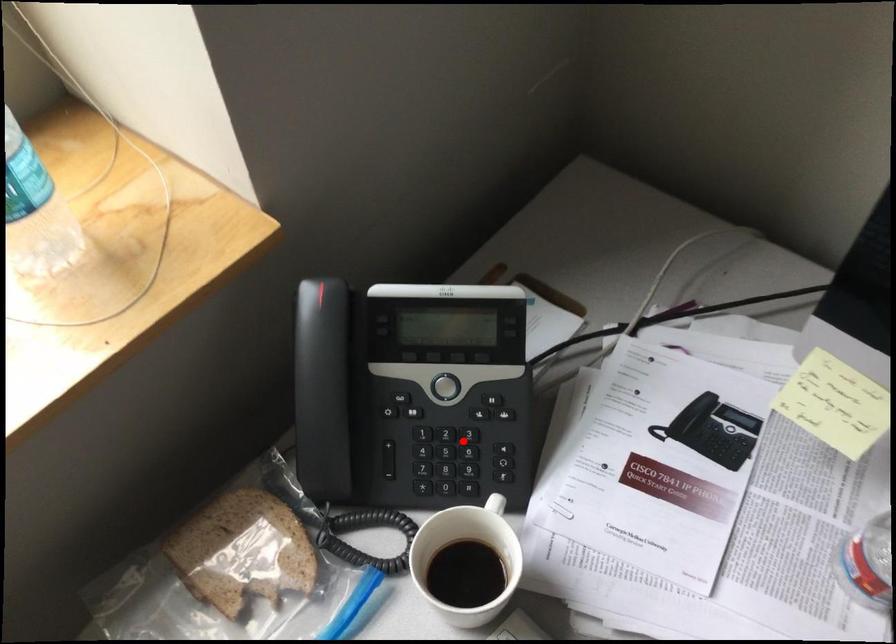
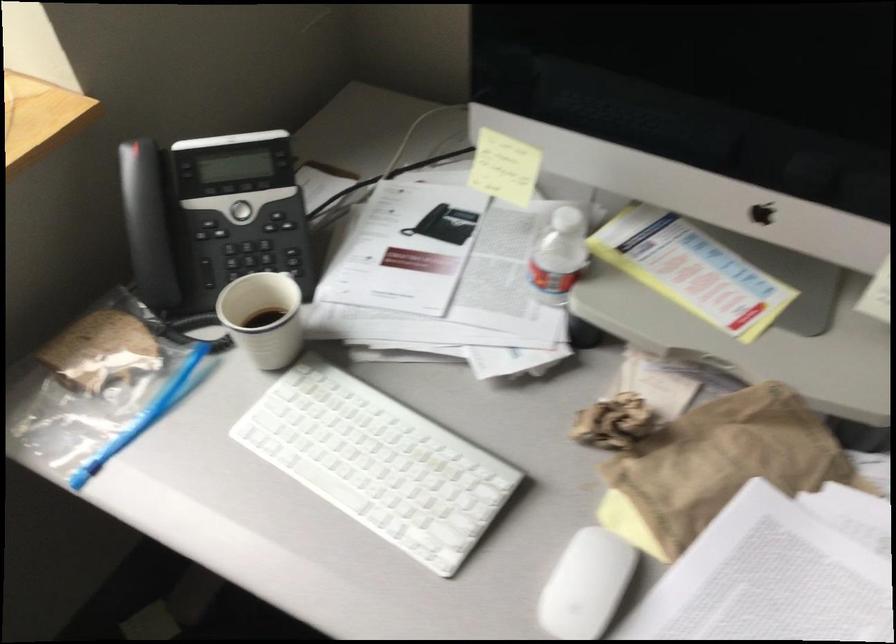
Question: I am providing you with two images of the same scene from different viewpoints. Given a red point in image1, look at the same physical point in image2. Is it:

Choices:
 (A) Closer to the viewpoint
 (B) Farther from the viewpoint

Answer: (B)